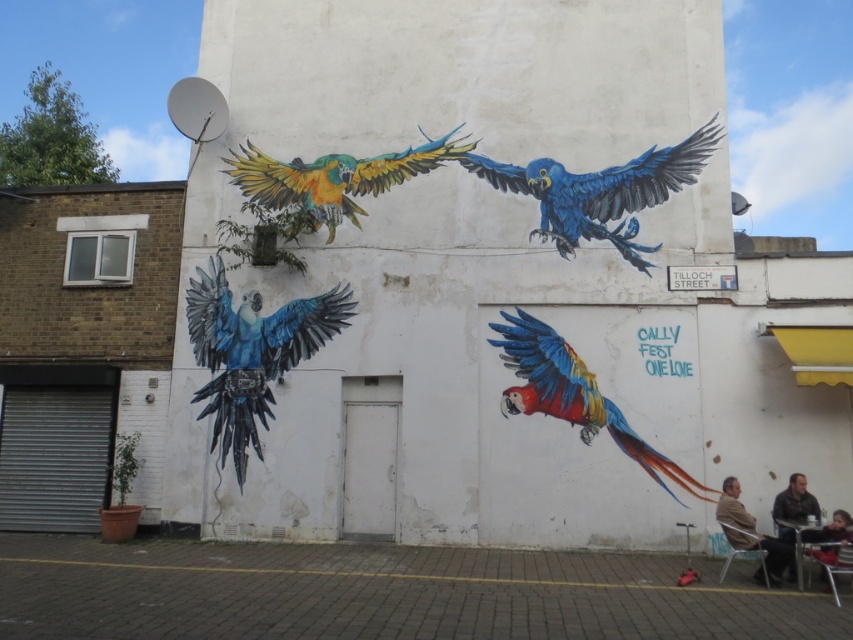
You are standing in front of the mural and want to place a small sticker exactly at the location of the leather jacket at lower right. What are the coordinates where you should place the sticker?

The coordinates for the leather jacket at lower right are at point (793, 506), so you should place the sticker at those coordinates.

You are an artist standing in front of the mural and want to paint a new detail between the blue glossy parrot at upper center and the red sweater at lower right. Which object should you paint first if you want to start from the bottom?

You should paint the red sweater at lower right first because it is located lower than the blue glossy parrot at upper center.